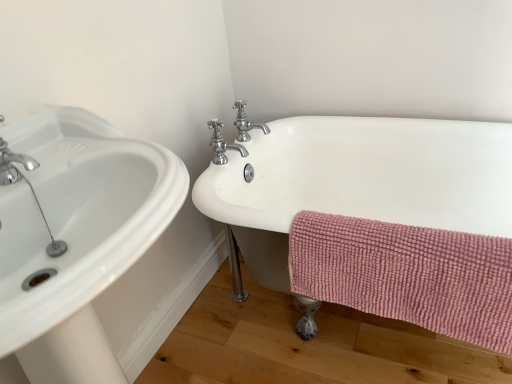
Question: Does pink chenille towel at lower right have a larger size compared to polished chrome faucet at upper center, the second tap when ordered from back to front?

Choices:
 (A) yes
 (B) no

Answer: (A)

Question: Does pink chenille towel at lower right have a smaller size compared to polished chrome faucet at upper center, the second tap when ordered from back to front?

Choices:
 (A) no
 (B) yes

Answer: (A)

Question: Is polished chrome faucet at upper center, the second tap when ordered from back to front, located within pink chenille towel at lower right?

Choices:
 (A) no
 (B) yes

Answer: (A)

Question: Is the position of pink chenille towel at lower right more distant than that of polished chrome faucet at upper center, which is counted as the 1th tap, starting from the front?

Choices:
 (A) yes
 (B) no

Answer: (B)

Question: Is polished chrome faucet at upper center, the second tap when ordered from back to front, at the back of pink chenille towel at lower right?

Choices:
 (A) yes
 (B) no

Answer: (B)

Question: Could you tell me if pink chenille towel at lower right is facing polished chrome faucet at upper center, which is counted as the 1th tap, starting from the front?

Choices:
 (A) yes
 (B) no

Answer: (B)

Question: Does polished chrome faucet at upper center, which is counted as the 1th tap, starting from the front, have a lesser height compared to pink chenille towel at lower right?

Choices:
 (A) yes
 (B) no

Answer: (A)

Question: Considering the relative sizes of polished chrome faucet at upper center, which is counted as the 1th tap, starting from the front, and pink chenille towel at lower right in the image provided, is polished chrome faucet at upper center, which is counted as the 1th tap, starting from the front, thinner than pink chenille towel at lower right?

Choices:
 (A) yes
 (B) no

Answer: (B)

Question: Can you confirm if polished chrome faucet at upper center, the second tap when ordered from back to front, is wider than pink chenille towel at lower right?

Choices:
 (A) yes
 (B) no

Answer: (A)

Question: Does polished chrome faucet at upper center, the second tap when ordered from back to front, have a smaller size compared to pink chenille towel at lower right?

Choices:
 (A) no
 (B) yes

Answer: (B)

Question: Is polished chrome faucet at upper center, which is counted as the 1th tap, starting from the front, far away from pink chenille towel at lower right?

Choices:
 (A) yes
 (B) no

Answer: (B)

Question: Is polished chrome faucet at upper center, which is counted as the 1th tap, starting from the front, oriented away from pink chenille towel at lower right?

Choices:
 (A) yes
 (B) no

Answer: (B)

Question: Considering the relative sizes of white ceramic bathtub at right and chrome/metallic faucet at upper center, positioned as the second tap in front-to-back order, in the image provided, is white ceramic bathtub at right thinner than chrome/metallic faucet at upper center, positioned as the second tap in front-to-back order,?

Choices:
 (A) yes
 (B) no

Answer: (B)